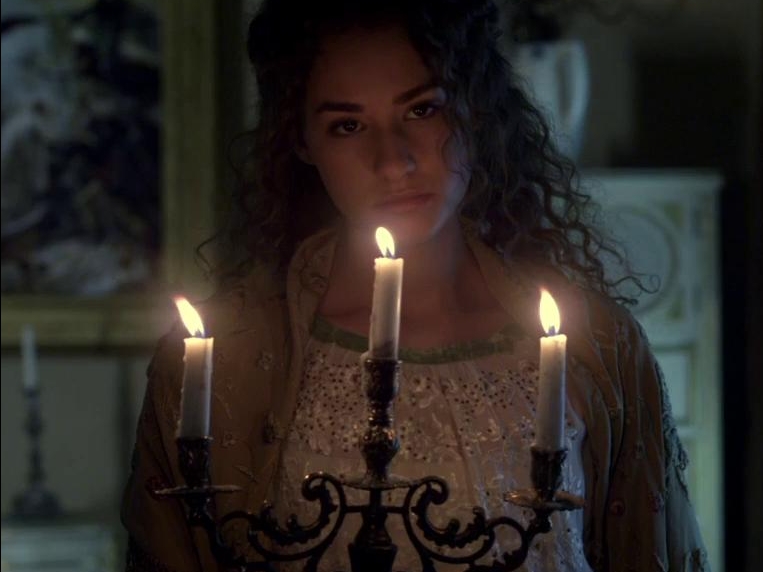
Locate an element on the screen. The image size is (763, 572). painting is located at coordinates (104, 213).